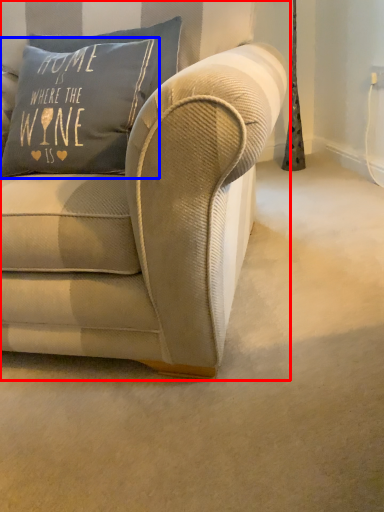
Question: Among these objects, which one is nearest to the camera, studio couch (highlighted by a red box) or pillow (highlighted by a blue box)?

Choices:
 (A) studio couch
 (B) pillow

Answer: (A)